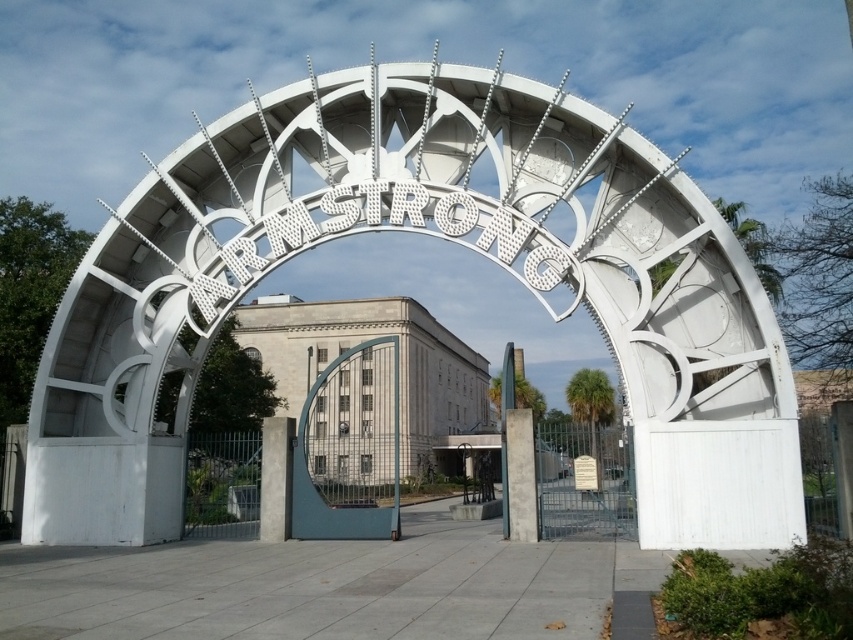
Between white metallic gate at center and blue metallic gate at center, which one appears on the right side from the viewer's perspective?

white metallic gate at center

Does point (712, 500) lie behind point (293, 513)?

No, (712, 500) is in front of (293, 513).

I want to click on white metallic gate at center, so click(x=439, y=237).